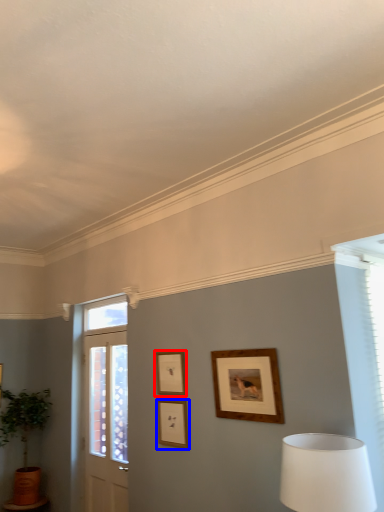
Question: Which object is further to the camera taking this photo, picture frame (highlighted by a red box) or picture frame (highlighted by a blue box)?

Choices:
 (A) picture frame
 (B) picture frame

Answer: (A)